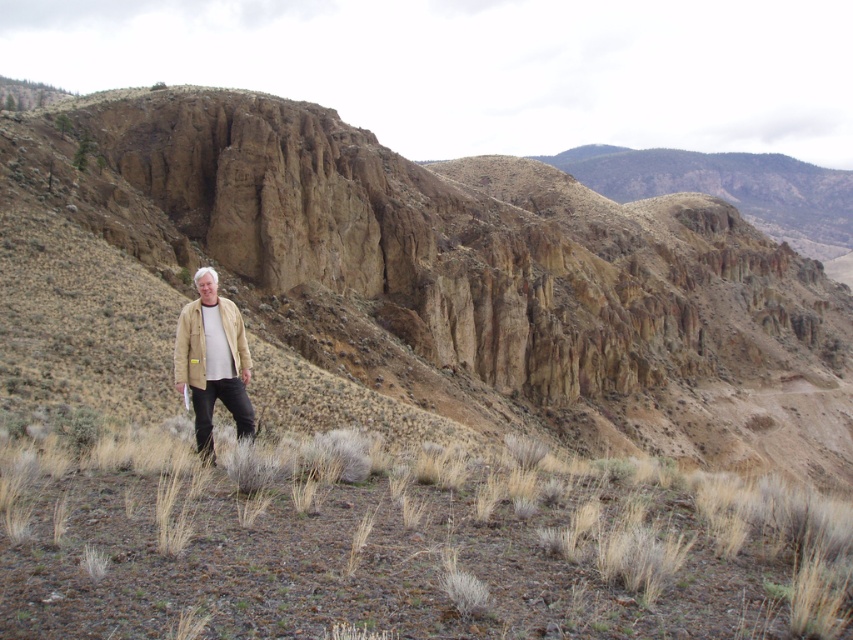
Can you confirm if brown dirt at center is positioned below tan suede trench coat at center?

Yes.

Is point (535, 529) behind point (204, 362)?

No, it is in front of (204, 362).

Who is more forward, [689,612] or [195,333]?

Point [689,612]

Find the location of a particular element. The image size is (853, 640). brown dirt at center is located at coordinates (399, 541).

Can you confirm if brown dirt at center is thinner than beige fabric jacket at lower left?

No.

Is point (759, 584) farther from viewer compared to point (221, 396)?

No, it is not.

The height and width of the screenshot is (640, 853). What are the coordinates of `brown dirt at center` in the screenshot? It's located at (399, 541).

Is brown rocky mountain at center further to camera compared to brown dirt at center?

Yes, it is.

Is brown rocky mountain at center to the left of brown dirt at center from the viewer's perspective?

No, brown rocky mountain at center is not to the left of brown dirt at center.

Does point (751, 369) come closer to viewer compared to point (123, 481)?

That is False.

At what (x,y) coordinates should I click in order to perform the action: click on brown rocky mountain at center. Please return your answer as a coordinate pair (x, y). The width and height of the screenshot is (853, 640). Looking at the image, I should click on (462, 273).